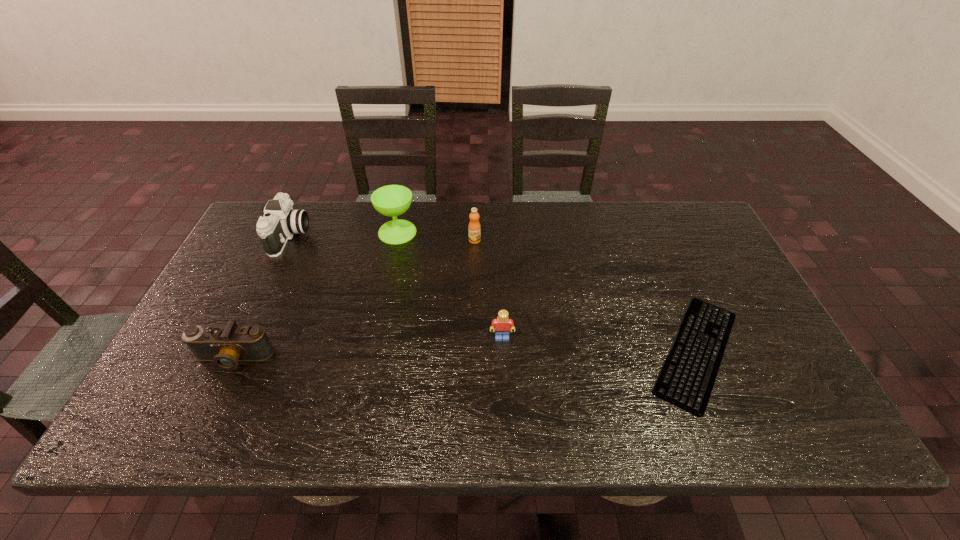
In the image, there is a desktop. Find the location of `vacant space at the far edge`. vacant space at the far edge is located at coordinates (x=376, y=225).

This screenshot has height=540, width=960. In order to click on free space at the near edge of the desktop in this screenshot , I will do `click(530, 420)`.

Identify the location of free space at the left edge of the desktop. The image size is (960, 540). (228, 305).

Where is `free space at the right edge`? The width and height of the screenshot is (960, 540). free space at the right edge is located at coordinates (691, 299).

I want to click on vacant region at the far left corner, so click(x=288, y=241).

Image resolution: width=960 pixels, height=540 pixels. Identify the location of free space at the near left corner of the desktop. (162, 420).

What are the coordinates of `free space between the orange juice and the third object from left to right` in the screenshot? It's located at (436, 236).

Locate an element on the screen. The image size is (960, 540). vacant point located between the shorter camera and the rightmost object is located at coordinates tap(465, 355).

You are a GUI agent. You are given a task and a screenshot of the screen. Output one action in this format:
    pyautogui.click(x=<x>, y=<y>)
    Task: Click on the vacant area between the Lego and the shorter camera
    This screenshot has height=540, width=960.
    Given the screenshot: What is the action you would take?
    pyautogui.click(x=368, y=348)

Locate an element on the screen. vacant point located between the shorter camera and the fourth object from left to right is located at coordinates (354, 299).